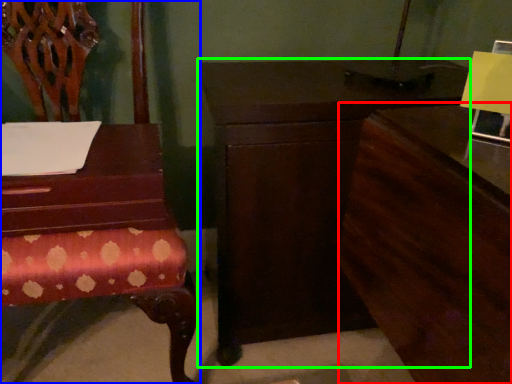
Question: Considering the real-world distances, which object is closest to dresser (highlighted by a red box)? chair (highlighted by a blue box) or nightstand (highlighted by a green box).

Choices:
 (A) chair
 (B) nightstand

Answer: (B)